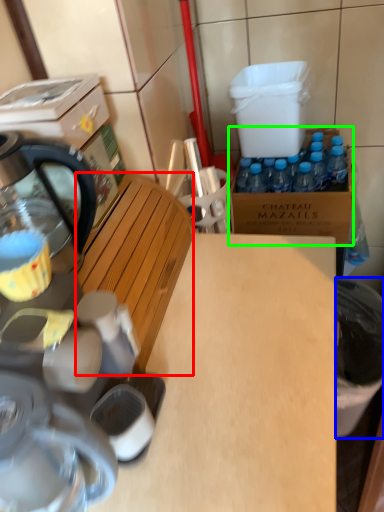
Question: Which is nearer to the wood (highlighted by a red box)? trash bin/can (highlighted by a blue box) or cardboard box (highlighted by a green box).

Choices:
 (A) trash bin/can
 (B) cardboard box

Answer: (A)